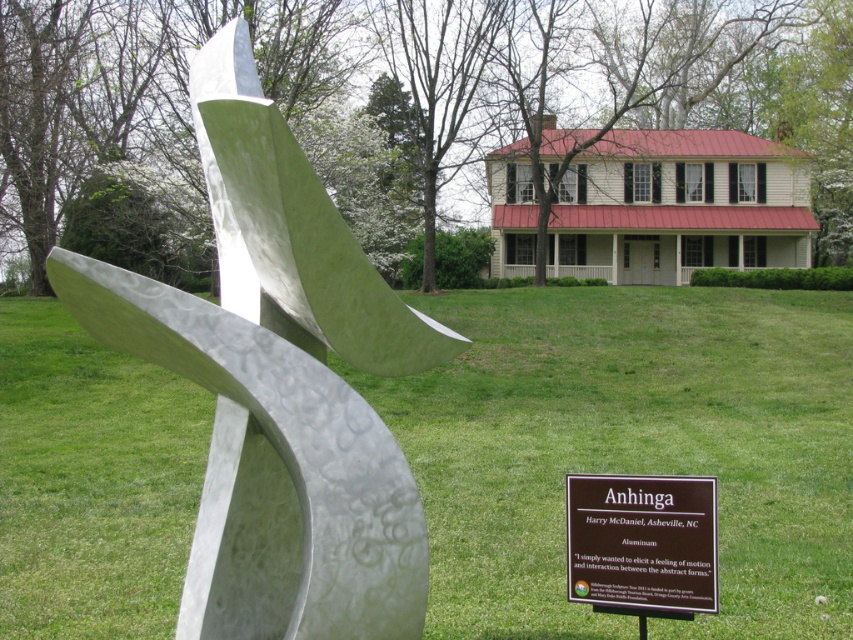
You are a gardener who needs to mow the lawn. You see the green grass at lower center and the brown aluminum sign at center. Which object is taller and requires more attention for trimming?

The green grass at lower center is taller than the brown aluminum sign at center, so the green grass at lower center requires more attention for trimming.

You are a photographer planning to take a wide shot of the sculpture and the house. You need to ensure that both the green grass at lower center and the brown aluminum sign at center are visible in the frame. Given their sizes, which object will occupy more space in the photo?

The green grass at lower center has a larger size compared to the brown aluminum sign at center, so it will occupy more space in the photo.

You are a photographer planning to take a picture of the brown aluminum sign at center. You want to ensure that the green grass at lower center does not block the view of the sign. Based on the scene, will the grass be visible in front of or behind the sign?

The green grass at lower center is above the brown aluminum sign at center, so the grass will be visible in front of the sign.